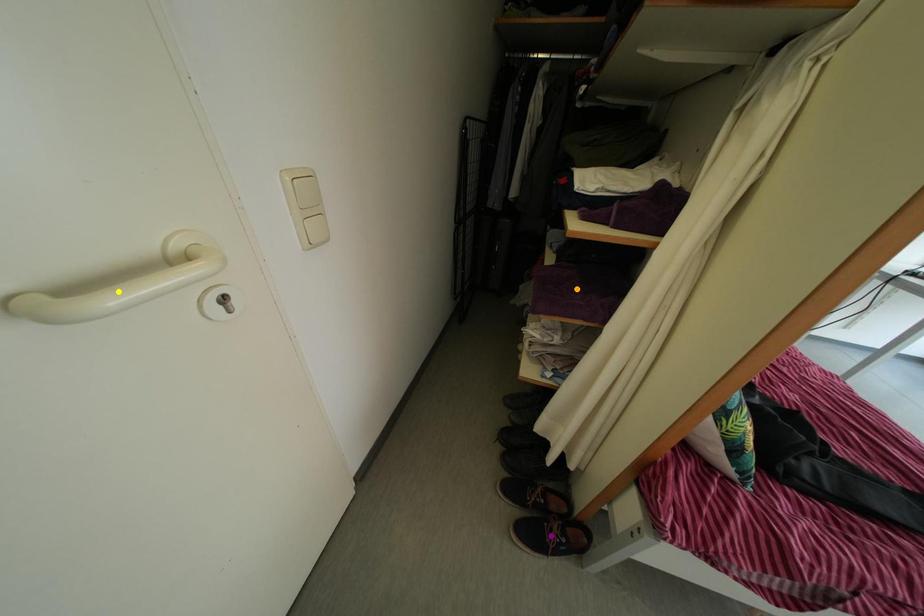
Order these from nearest to farthest:
A) purple point
B) orange point
C) yellow point

yellow point → purple point → orange point